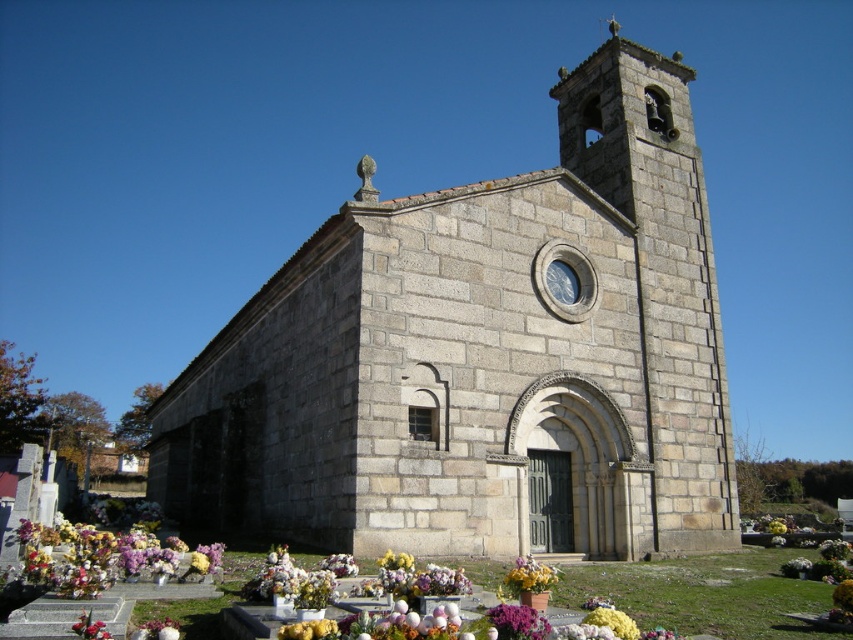
In the scene shown: Can you confirm if purple matte flower at lower center is positioned to the left of white floral bouquet at center?

Indeed, purple matte flower at lower center is positioned on the left side of white floral bouquet at center.

Is point (537, 625) positioned after point (798, 568)?

No, it is in front of (798, 568).

The image size is (853, 640). What are the coordinates of `purple matte flower at lower center` in the screenshot? It's located at (517, 621).

Does point (514, 611) come in front of point (84, 637)?

No, (514, 611) is behind (84, 637).

Which is behind, point (500, 628) or point (85, 618)?

Positioned behind is point (85, 618).

Who is more distant from viewer, [525,612] or [82,632]?

The point [525,612] is behind.

This screenshot has width=853, height=640. Identify the location of purple matte flower at lower center. (517, 621).

The width and height of the screenshot is (853, 640). What do you see at coordinates (102, 557) in the screenshot?
I see `multicolored floral bouquet at lower left` at bounding box center [102, 557].

Is multicolored floral bouquet at lower left shorter than purple matte flower at lower center?

No.

Locate an element on the screen. multicolored floral bouquet at lower left is located at coordinates (102, 557).